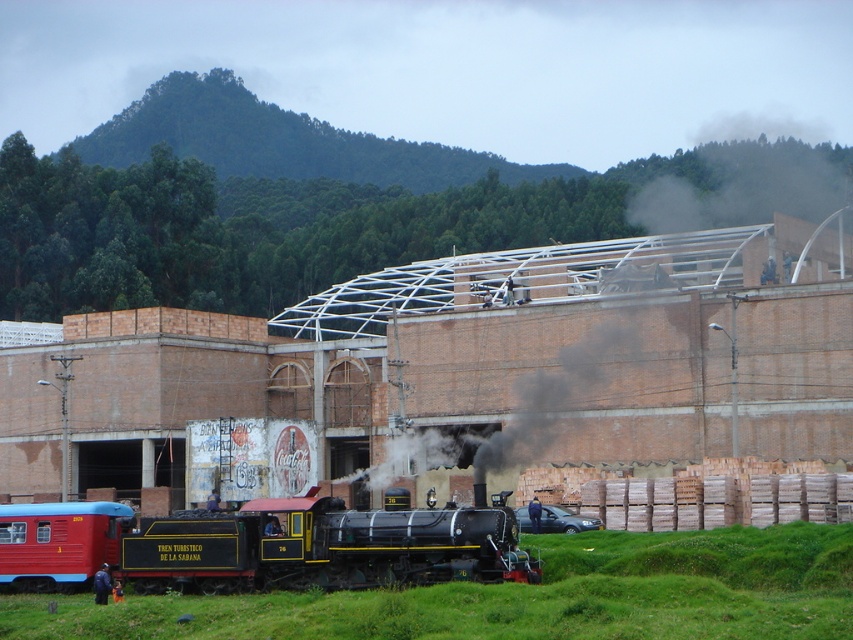
Question: Considering the relative positions of black smoke at center and black polished steam locomotive at center in the image provided, where is black smoke at center located with respect to black polished steam locomotive at center?

Choices:
 (A) below
 (B) above

Answer: (B)

Question: Which point is farther to the camera?

Choices:
 (A) (770, 412)
 (B) (473, 531)

Answer: (A)

Question: Does black smoke at center appear on the left side of black polished steam locomotive at center?

Choices:
 (A) yes
 (B) no

Answer: (B)

Question: Can you confirm if black smoke at center is smaller than black polished steam locomotive at center?

Choices:
 (A) no
 (B) yes

Answer: (A)

Question: Which of the following is the closest to the observer?

Choices:
 (A) (409, 524)
 (B) (788, 424)

Answer: (A)

Question: Which object appears farthest from the camera in this image?

Choices:
 (A) black polished steam locomotive at center
 (B) black smoke at center

Answer: (B)